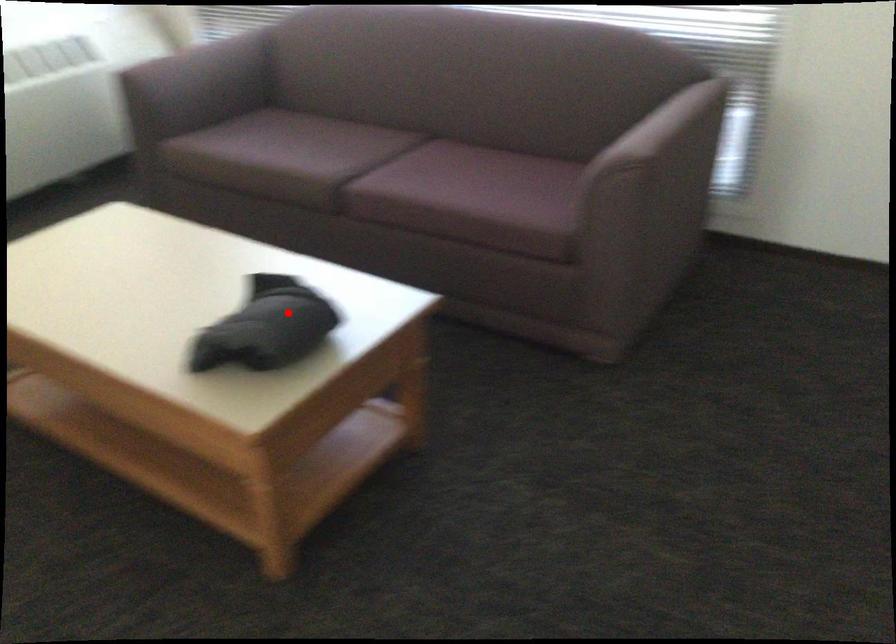
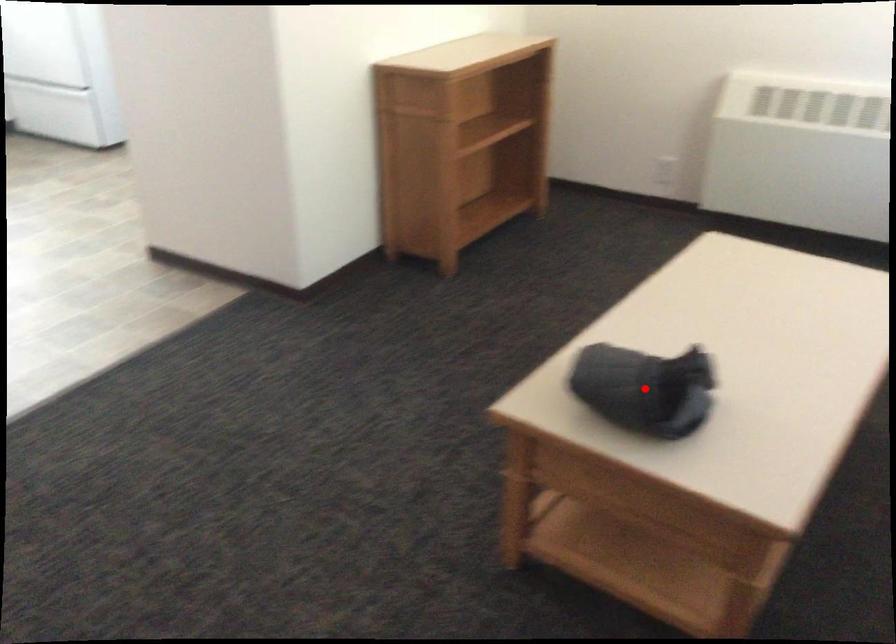
I am providing you with two images of the same scene from different viewpoints. A red point is marked on the first image and another point is marked on the second image. Does the point marked in image1 correspond to the same location as the one in image2?

Yes